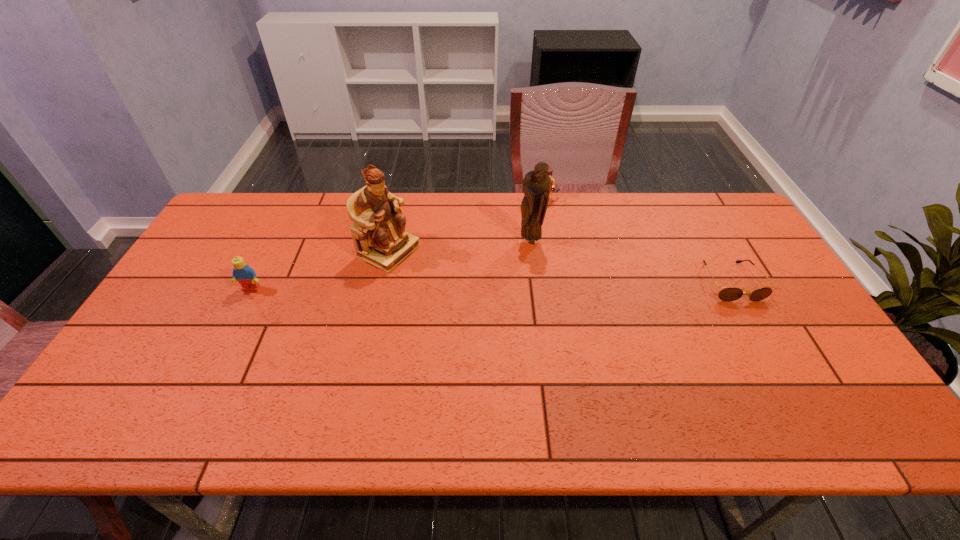
Find the location of a particular element. The image size is (960, 540). Lego positioned at the far edge is located at coordinates (550, 171).

Where is `object that is at the right edge`? This screenshot has width=960, height=540. object that is at the right edge is located at coordinates (728, 294).

The image size is (960, 540). Find the location of `vacant space at the far edge of the desktop`. vacant space at the far edge of the desktop is located at coordinates (302, 206).

Locate an element on the screen. vacant region at the near edge of the desktop is located at coordinates (717, 395).

Locate an element on the screen. The image size is (960, 540). free space at the far left corner is located at coordinates (246, 214).

You are a GUI agent. You are given a task and a screenshot of the screen. Output one action in this format:
    pyautogui.click(x=<x>, y=<y>)
    Task: Click on the vacant space in between the rightmost object and the leftmost object
    The height and width of the screenshot is (540, 960).
    Given the screenshot: What is the action you would take?
    pyautogui.click(x=491, y=286)

At what (x,y) coordinates should I click in order to perform the action: click on free space between the left Lego and the sunglasses. Please return your answer as a coordinate pair (x, y). This screenshot has height=540, width=960. Looking at the image, I should click on pos(491,286).

Identify the location of empty location between the leftmost object and the fourth object from right to left. (321, 271).

The image size is (960, 540). Find the location of `empty space between the left Lego and the left figurine`. empty space between the left Lego and the left figurine is located at coordinates (321, 271).

Locate an element on the screen. The height and width of the screenshot is (540, 960). free area in between the right figurine and the fourth object from right to left is located at coordinates pos(460,247).